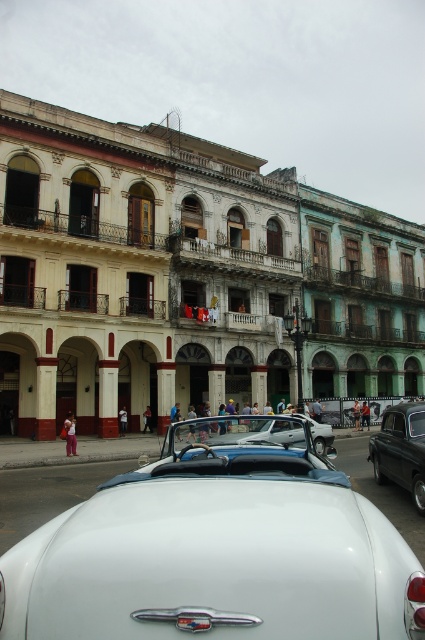
Question: Which object is farther from the camera taking this photo?

Choices:
 (A) shiny black car at right
 (B) white glossy car at center

Answer: (A)

Question: Which of these objects is positioned closest to the white glossy convertible at center?

Choices:
 (A) white glossy car at center
 (B) shiny black car at right

Answer: (A)

Question: Does white glossy car at center have a lesser width compared to shiny black car at right?

Choices:
 (A) yes
 (B) no

Answer: (B)

Question: Which point is farther from the camera taking this photo?

Choices:
 (A) (408, 440)
 (B) (195, 502)
 (C) (195, 433)

Answer: (A)

Question: In this image, where is white glossy car at center located relative to white glossy convertible at center?

Choices:
 (A) right
 (B) left

Answer: (B)

Question: Does white glossy car at center appear over white glossy convertible at center?

Choices:
 (A) no
 (B) yes

Answer: (B)